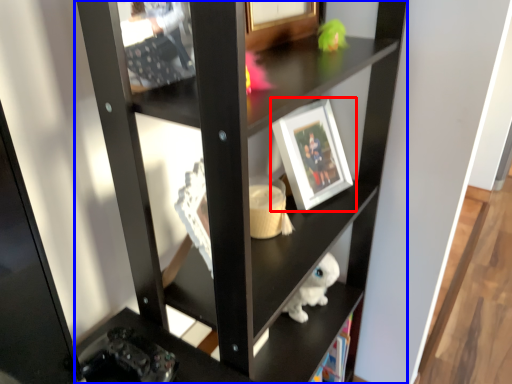
Question: Which object is further to the camera taking this photo, picture frame (highlighted by a red box) or shelf (highlighted by a blue box)?

Choices:
 (A) picture frame
 (B) shelf

Answer: (A)